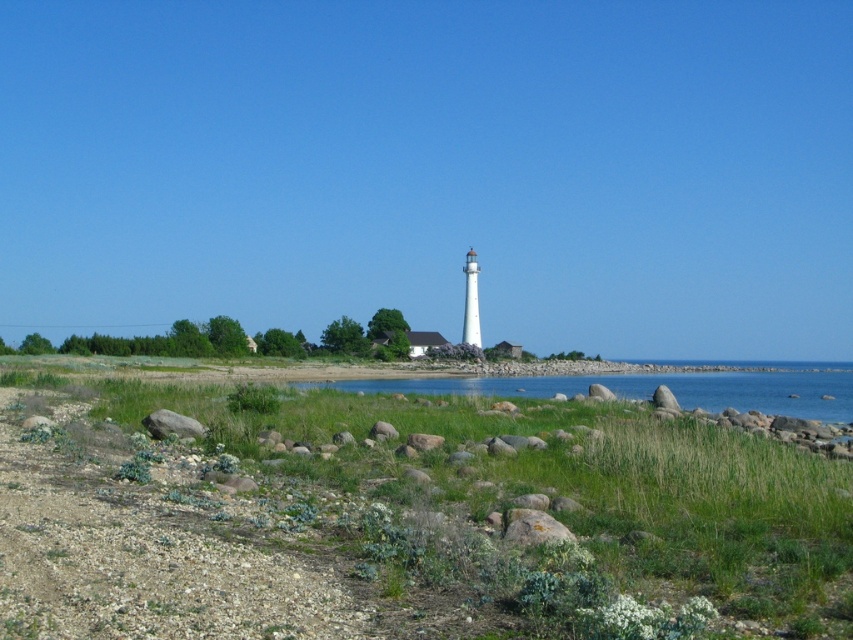
Question: Based on their relative distances, which object is nearer to the brown rock at lower center?

Choices:
 (A) blue water at center
 (B) gray rough rock at lower left

Answer: (B)

Question: Is blue water at center wider than brown rock at lower center?

Choices:
 (A) no
 (B) yes

Answer: (B)

Question: Which object appears closest to the camera in this image?

Choices:
 (A) blue water at center
 (B) gray rough rock at lower left

Answer: (B)

Question: Can you confirm if blue water at center is positioned to the right of brown rock at lower center?

Choices:
 (A) yes
 (B) no

Answer: (A)

Question: Is blue water at center above brown rock at lower center?

Choices:
 (A) no
 (B) yes

Answer: (A)

Question: Which point is farther to the camera?

Choices:
 (A) (549, 536)
 (B) (445, 380)
 (C) (175, 426)

Answer: (B)